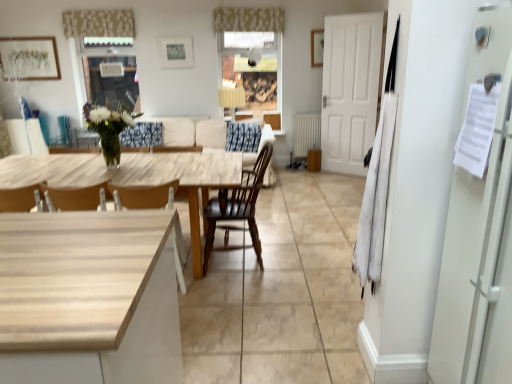
Question: Considering the relative sizes of beige floral fabric valance at upper center, positioned as the 2th curtain in left-to-right order, and metallic silver picture frame at upper center, which is counted as the 2th picture frame, starting from the left, in the image provided, is beige floral fabric valance at upper center, positioned as the 2th curtain in left-to-right order, taller than metallic silver picture frame at upper center, which is counted as the 2th picture frame, starting from the left,?

Choices:
 (A) yes
 (B) no

Answer: (B)

Question: Is beige floral fabric valance at upper center, positioned as the 2th curtain in left-to-right order, behind metallic silver picture frame at upper center, which is counted as the 2th picture frame, starting from the left?

Choices:
 (A) no
 (B) yes

Answer: (A)

Question: Is beige floral fabric valance at upper center, which appears as the first curtain when viewed from the right, in front of metallic silver picture frame at upper center, which is counted as the 2th picture frame, starting from the left?

Choices:
 (A) yes
 (B) no

Answer: (A)

Question: Is metallic silver picture frame at upper center, positioned as the 2th picture frame in right-to-left order, surrounded by beige floral fabric valance at upper center, positioned as the 2th curtain in left-to-right order?

Choices:
 (A) yes
 (B) no

Answer: (B)

Question: From the image's perspective, is beige floral fabric valance at upper center, which appears as the first curtain when viewed from the right, below metallic silver picture frame at upper center, which is counted as the 2th picture frame, starting from the left?

Choices:
 (A) yes
 (B) no

Answer: (B)

Question: Does beige floral fabric valance at upper center, which appears as the first curtain when viewed from the right, have a lesser height compared to metallic silver picture frame at upper center, positioned as the 2th picture frame in right-to-left order?

Choices:
 (A) no
 (B) yes

Answer: (B)

Question: Does beige floral fabric valance at upper center, which appears as the first curtain when viewed from the right, contain beige fabric couch at center?

Choices:
 (A) yes
 (B) no

Answer: (B)

Question: Is beige floral fabric valance at upper center, which appears as the first curtain when viewed from the right, closer to the viewer compared to beige fabric couch at center?

Choices:
 (A) no
 (B) yes

Answer: (A)

Question: Is beige floral fabric valance at upper center, positioned as the 2th curtain in left-to-right order, at the right side of beige fabric couch at center?

Choices:
 (A) no
 (B) yes

Answer: (B)

Question: Is beige floral fabric valance at upper center, which appears as the first curtain when viewed from the right, facing away from beige fabric couch at center?

Choices:
 (A) no
 (B) yes

Answer: (A)

Question: Can you confirm if beige floral fabric valance at upper center, which appears as the first curtain when viewed from the right, is bigger than beige fabric couch at center?

Choices:
 (A) yes
 (B) no

Answer: (B)

Question: Is beige floral fabric valance at upper center, which appears as the first curtain when viewed from the right, outside beige fabric couch at center?

Choices:
 (A) yes
 (B) no

Answer: (A)

Question: Is wooden chair at center, the second chair from the right, taller than beige floral fabric valance at upper center, positioned as the 2th curtain in left-to-right order?

Choices:
 (A) yes
 (B) no

Answer: (A)